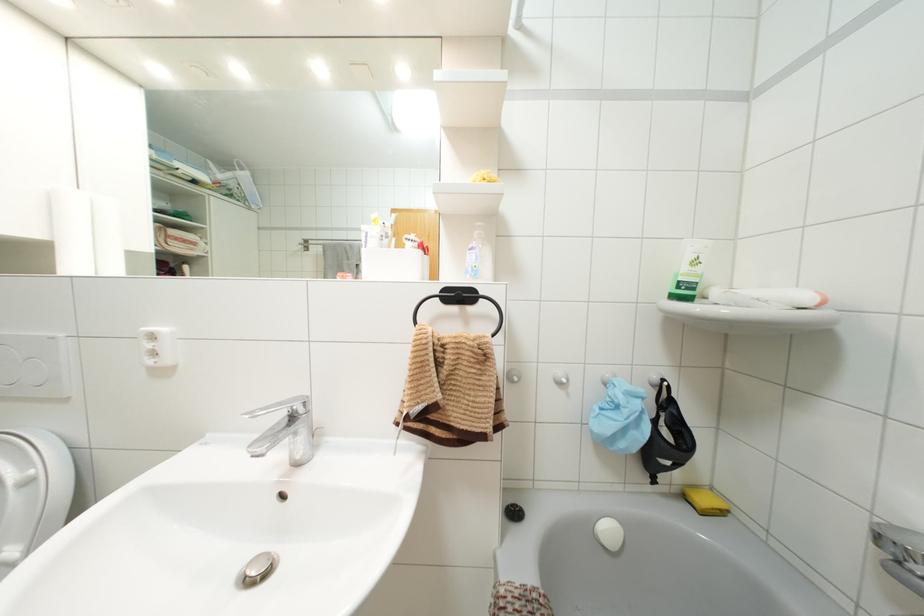
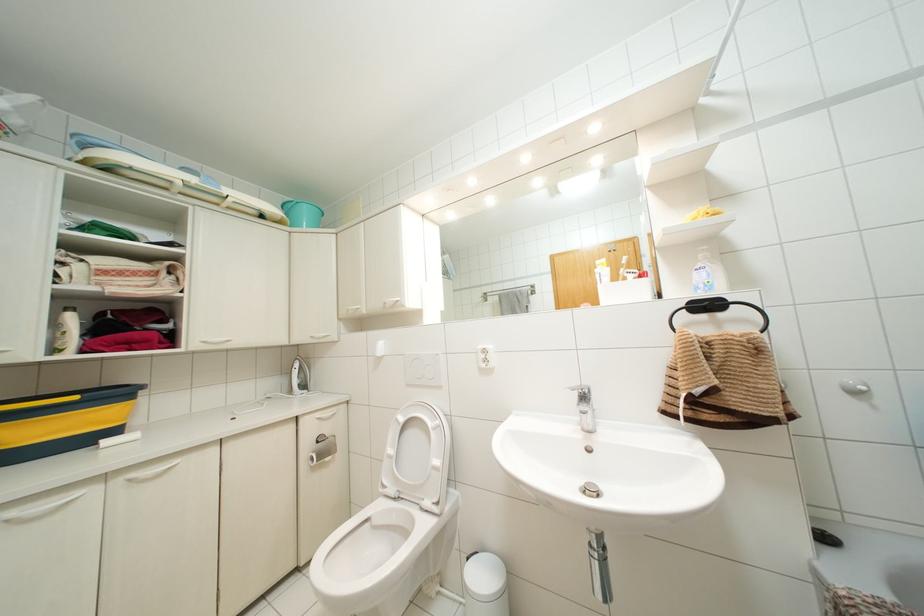
The point at (x=473, y=256) is marked in the first image. Where is the corresponding point in the second image?

(703, 274)